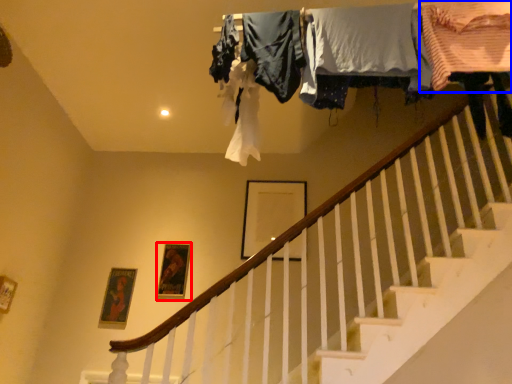
Question: Which of the following is the farthest to the observer, picture frame (highlighted by a red box) or clothing (highlighted by a blue box)?

Choices:
 (A) picture frame
 (B) clothing

Answer: (A)